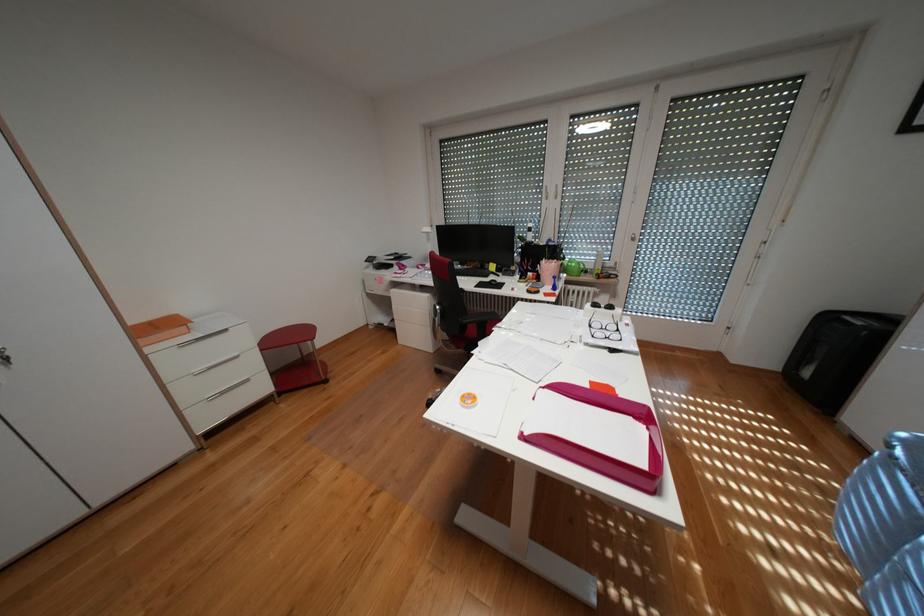
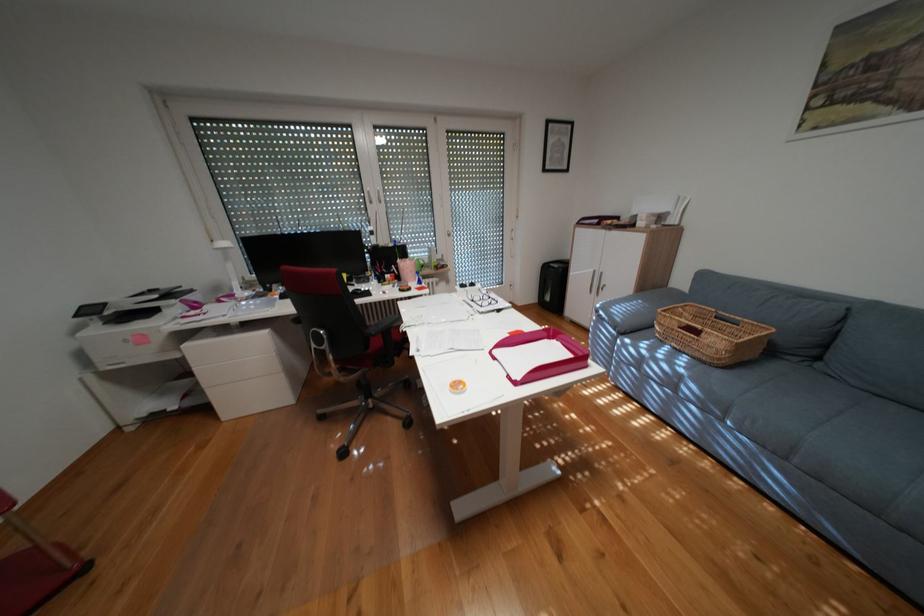
Question: The camera is either moving clockwise (left) or counter-clockwise (right) around the object. The first image is from the beginning of the video and the second image is from the end. Is the camera moving left or right when shooting the video?

Choices:
 (A) Left
 (B) Right

Answer: (A)